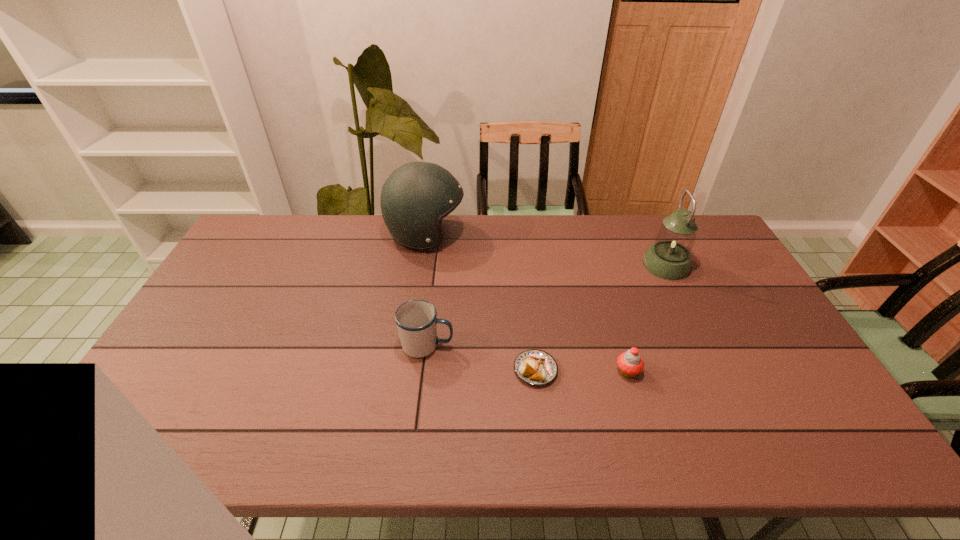
This screenshot has height=540, width=960. I want to click on object that is the third closest one to the third tallest object, so click(x=630, y=363).

What are the coordinates of `object identified as the fourth closest to the third shortest object` in the screenshot? It's located at [669, 258].

This screenshot has width=960, height=540. I want to click on vacant space that satisfies the following two spatial constraints: 1. on the back side of the fourth object from left to right; 2. at the face opening of the football helmet, so click(x=587, y=235).

Identify the location of free space that satisfies the following two spatial constraints: 1. on the handle side of the third object from left to right; 2. on the right side of the third tallest object. (424, 370).

Find the location of a particular element. Image resolution: width=960 pixels, height=540 pixels. free spot that satisfies the following two spatial constraints: 1. on the front side of the fourth tallest object; 2. on the left side of the shortest object is located at coordinates point(536,371).

The image size is (960, 540). In order to click on free location that satisfies the following two spatial constraints: 1. at the face opening of the football helmet; 2. on the back side of the rightmost object in this screenshot , I will do `click(421, 265)`.

Where is `free space that satisfies the following two spatial constraints: 1. on the back side of the lantern; 2. at the face opening of the football helmet`? The height and width of the screenshot is (540, 960). free space that satisfies the following two spatial constraints: 1. on the back side of the lantern; 2. at the face opening of the football helmet is located at coordinates (652, 235).

The height and width of the screenshot is (540, 960). Identify the location of vacant space that satisfies the following two spatial constraints: 1. at the face opening of the second object from right to left; 2. on the left side of the football helmet. (405, 371).

Locate an element on the screen. free space in the image that satisfies the following two spatial constraints: 1. on the back side of the second shortest object; 2. on the handle side of the mug is located at coordinates (620, 345).

Where is `free space that satisfies the following two spatial constraints: 1. on the back side of the fourth object from left to right; 2. on the handle side of the mug`? This screenshot has height=540, width=960. free space that satisfies the following two spatial constraints: 1. on the back side of the fourth object from left to right; 2. on the handle side of the mug is located at coordinates (620, 345).